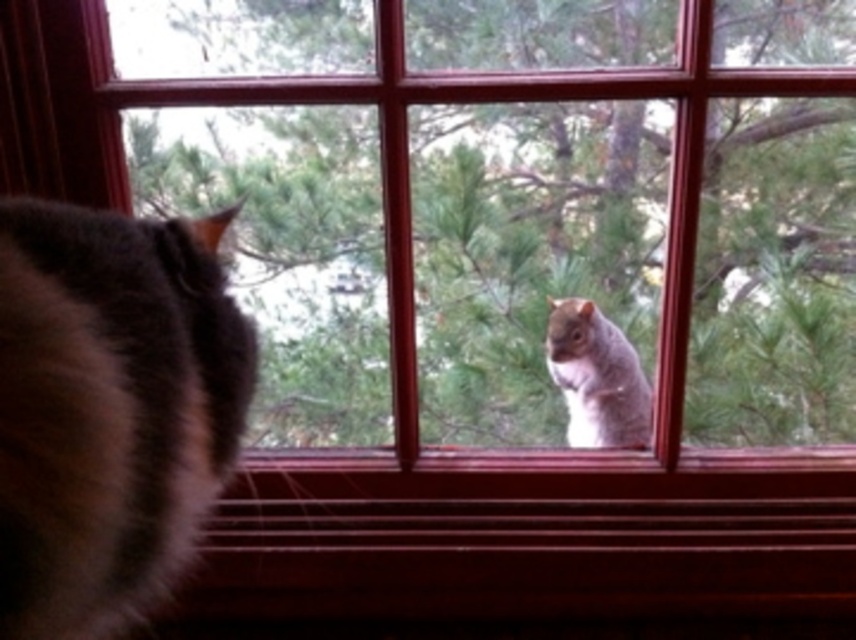
You are standing in the room looking through the window with a red frame. There is a point marked at coordinates [110,410]. What object is located at that point?

The point at coordinates [110,410] marks the location of the brown fluffy cat at left.

You are standing in the room where the brown fluffy cat at left is located. The window with a red frame is directly ahead of you. If you want to see the squirrel outside the window, should you move closer to the cat or move away from it?

The brown fluffy cat at left is positioned at point (110,410). Since the window with a red frame is directly ahead, moving closer to the cat would bring you nearer to the window, allowing you to see the squirrel outside better. Therefore, move closer to the brown fluffy cat at left.

You are looking through the window with a red frame and see the green leafy tree at center and the gray furry squirrel at upper center. Which object is positioned more to the left side of the window?

The green leafy tree at center is positioned more to the left side of the window than the gray furry squirrel at upper center.